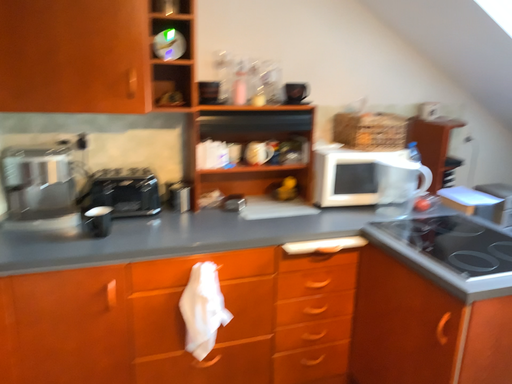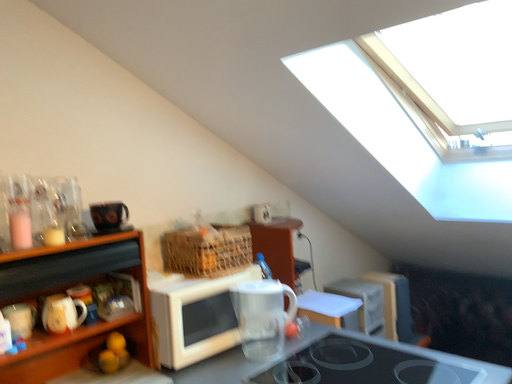
Question: Which way did the camera rotate in the video?

Choices:
 (A) rotated right
 (B) rotated left

Answer: (A)